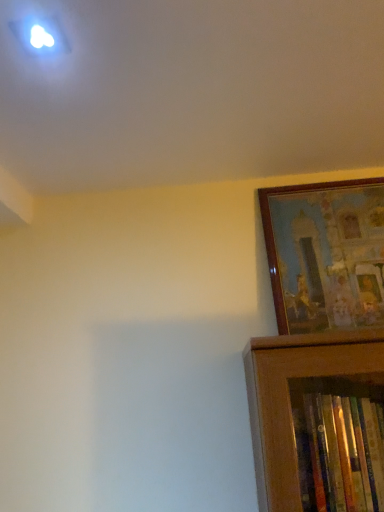
Image resolution: width=384 pixels, height=512 pixels. Identify the location of wooden picture frame at upper right. (325, 254).

What do you see at coordinates (325, 254) in the screenshot?
I see `wooden picture frame at upper right` at bounding box center [325, 254].

Measure the distance between wooden picture frame at upper right and camera.

wooden picture frame at upper right and camera are 1.13 meters apart.

Identify the location of wooden picture frame at upper right. The width and height of the screenshot is (384, 512). (325, 254).